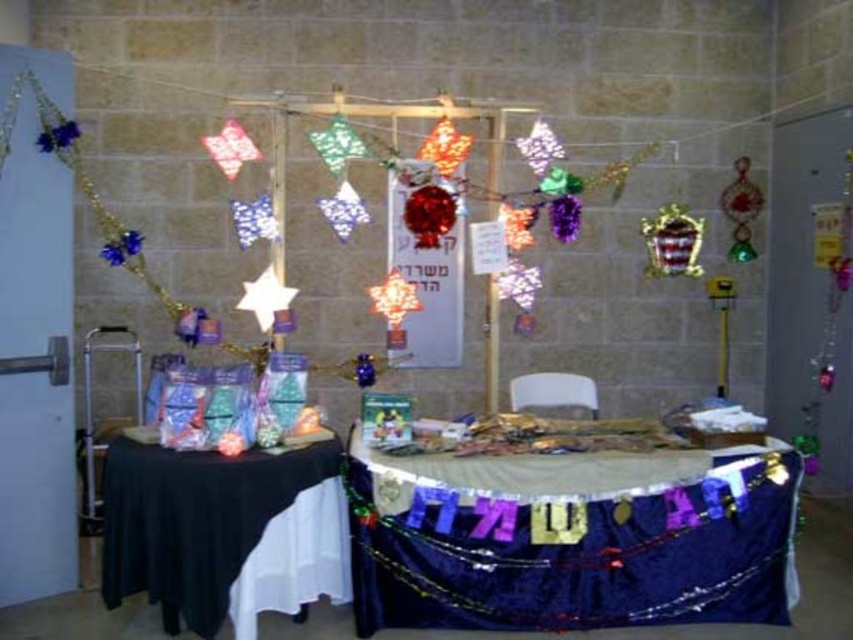
Who is positioned more to the left, shiny blue tablecloth at center or black fabric table at lower left?

Positioned to the left is black fabric table at lower left.

Does shiny blue tablecloth at center appear over black fabric table at lower left?

No, shiny blue tablecloth at center is not above black fabric table at lower left.

Which is in front, point (656, 509) or point (193, 564)?

Point (193, 564) is more forward.

At what (x,y) coordinates should I click in order to perform the action: click on shiny blue tablecloth at center. Please return your answer as a coordinate pair (x, y). The height and width of the screenshot is (640, 853). Looking at the image, I should click on (572, 540).